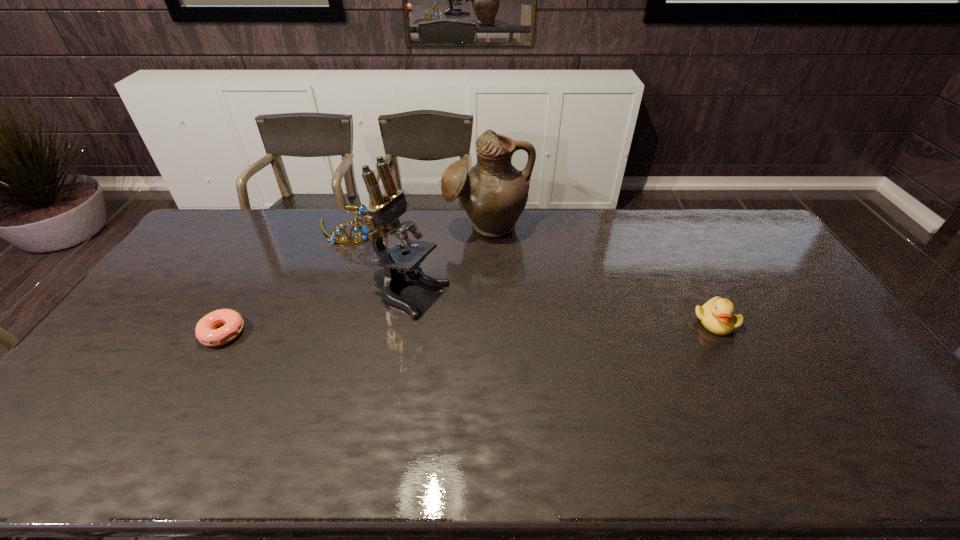
Where is `free space between the rightmost object and the microscope`? Image resolution: width=960 pixels, height=540 pixels. free space between the rightmost object and the microscope is located at coordinates (563, 308).

You are a GUI agent. You are given a task and a screenshot of the screen. Output one action in this format:
    pyautogui.click(x=<x>, y=<y>)
    Task: Click on the vacant space that's between the fourth shortest object and the microscope
    
    Given the screenshot: What is the action you would take?
    pyautogui.click(x=448, y=261)

This screenshot has width=960, height=540. Find the location of `free area in between the shortest object and the duckling`. free area in between the shortest object and the duckling is located at coordinates (469, 327).

You are a GUI agent. You are given a task and a screenshot of the screen. Output one action in this format:
    pyautogui.click(x=<x>, y=<y>)
    Task: Click on the empty location between the duckling and the pitcher
    This screenshot has width=960, height=540.
    Given the screenshot: What is the action you would take?
    pyautogui.click(x=601, y=273)

Where is `vacant area that lies between the leftmost object and the tiara`? vacant area that lies between the leftmost object and the tiara is located at coordinates click(288, 280).

Where is `free spot between the leftmost object and the pitcher`? free spot between the leftmost object and the pitcher is located at coordinates tap(355, 279).

This screenshot has height=540, width=960. What are the coordinates of `object that stands as the second closest to the rightmost object` in the screenshot? It's located at (382, 217).

Where is `object that is the closest to the doughnut`? This screenshot has height=540, width=960. object that is the closest to the doughnut is located at coordinates pos(382,217).

The height and width of the screenshot is (540, 960). Identify the location of free location that satisfies the following two spatial constraints: 1. on the front side of the tiara; 2. on the left side of the microscope. (328, 296).